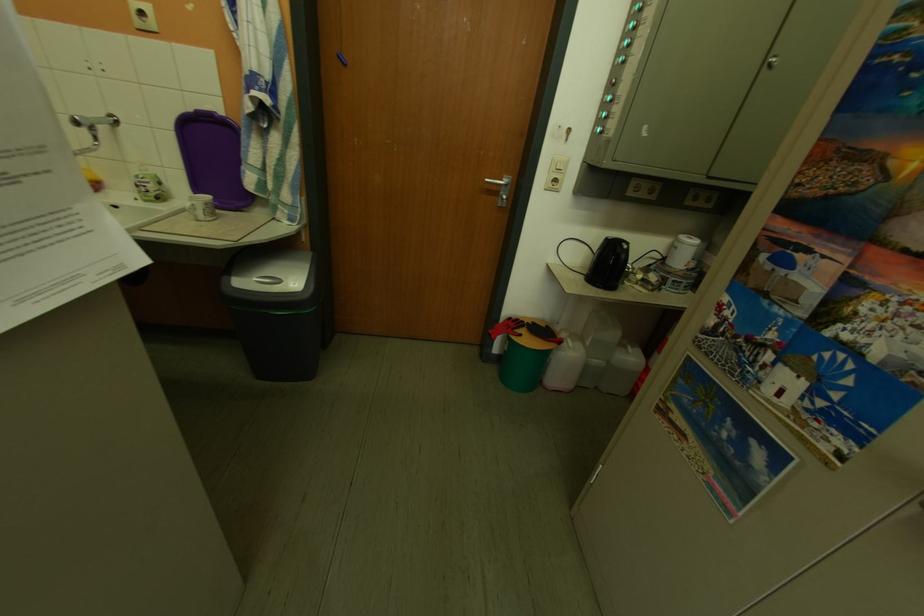
This screenshot has height=616, width=924. I want to click on cabinet lock, so click(558, 164).